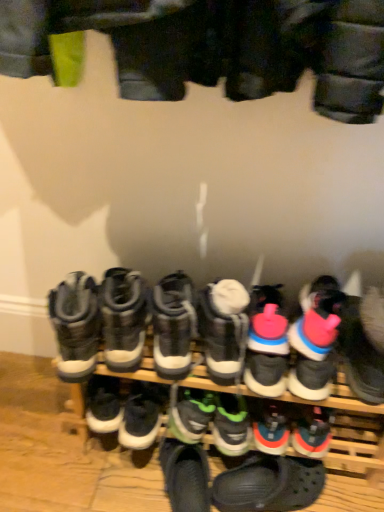
The image size is (384, 512). Describe the element at coordinates (231, 425) in the screenshot. I see `green rubber sneaker at center, which is the eighth footwear in left-to-right order` at that location.

I want to click on black rubber shoes at center, which is the seventh footwear from left to right, so click(x=216, y=337).

Image resolution: width=384 pixels, height=512 pixels. What do you see at coordinates (123, 318) in the screenshot? I see `white rubber boots at center, which ranks as the eleventh footwear in right-to-left order` at bounding box center [123, 318].

What do you see at coordinates (190, 413) in the screenshot?
I see `green matte sneakers at center, positioned as the eighth footwear in right-to-left order` at bounding box center [190, 413].

Describe the element at coordinates (223, 328) in the screenshot. I see `white suede boot at center, arranged as the sixth footwear when viewed from the left` at that location.

I want to click on green rubber sneaker at center, which is the eighth footwear in left-to-right order, so click(231, 425).

From the picture: From the image's perspective, is white matte sneaker at center, acting as the 10th footwear starting from the right, located above black rubber shoes at center, which appears as the 6th footwear when viewed from the right?

Incorrect, from the image's perspective, white matte sneaker at center, acting as the 10th footwear starting from the right, is lower than black rubber shoes at center, which appears as the 6th footwear when viewed from the right.

Which is more to the right, white matte sneaker at center, acting as the 10th footwear starting from the right, or black rubber shoes at center, which appears as the 6th footwear when viewed from the right?

black rubber shoes at center, which appears as the 6th footwear when viewed from the right, is more to the right.

Is white matte sneaker at center, acting as the 3th footwear starting from the left, in front of or behind black rubber shoes at center, which is the seventh footwear from left to right, in the image?

Clearly, white matte sneaker at center, acting as the 3th footwear starting from the left, is behind black rubber shoes at center, which is the seventh footwear from left to right.

Is black rubber shoes at center, which is the seventh footwear from left to right, in contact with pink rubber sneaker at center, placed as the 11th footwear when sorted from left to right?

black rubber shoes at center, which is the seventh footwear from left to right, is not next to pink rubber sneaker at center, placed as the 11th footwear when sorted from left to right, and they're not touching.

Based on their positions, is black rubber shoes at center, which is the seventh footwear from left to right, located to the left or right of pink rubber sneaker at center, arranged as the second footwear when viewed from the right?

Based on their positions, black rubber shoes at center, which is the seventh footwear from left to right, is located to the left of pink rubber sneaker at center, arranged as the second footwear when viewed from the right.

Considering the relative sizes of black rubber shoes at center, which is the seventh footwear from left to right, and pink rubber sneaker at center, arranged as the second footwear when viewed from the right, in the image provided, is black rubber shoes at center, which is the seventh footwear from left to right, wider than pink rubber sneaker at center, arranged as the second footwear when viewed from the right,?

No.

Is the position of white suede boot at center, which is the 7th footwear in right-to-left order, more distant than that of pink rubber sneaker at center, which appears as the fourth footwear when viewed from the right?

That is False.

Is white suede boot at center, which is the 7th footwear in right-to-left order, touching pink rubber sneaker at center, the ninth footwear from the left?

Indeed, white suede boot at center, which is the 7th footwear in right-to-left order, and pink rubber sneaker at center, the ninth footwear from the left, are beside each other and touching.

Image resolution: width=384 pixels, height=512 pixels. I want to click on footwear that is the 3rd one when counting leftward from the pink rubber sneaker at center, the ninth footwear from the left, so click(223, 328).

Could you tell me if white matte sneaker at center, acting as the 3th footwear starting from the left, is turned towards gray suede boots at left, which ranks as the twelfth footwear in right-to-left order?

No.

Do you think white matte sneaker at center, acting as the 3th footwear starting from the left, is within gray suede boots at left, the first footwear positioned from the left, or outside of it?

white matte sneaker at center, acting as the 3th footwear starting from the left, is spatially situated outside gray suede boots at left, the first footwear positioned from the left.

Considering the sizes of white matte sneaker at center, acting as the 10th footwear starting from the right, and gray suede boots at left, which ranks as the twelfth footwear in right-to-left order, in the image, is white matte sneaker at center, acting as the 10th footwear starting from the right, wider or thinner than gray suede boots at left, which ranks as the twelfth footwear in right-to-left order,?

Considering their sizes, white matte sneaker at center, acting as the 10th footwear starting from the right, looks slimmer than gray suede boots at left, which ranks as the twelfth footwear in right-to-left order.

Is white matte sneaker at center, acting as the 10th footwear starting from the right, positioned behind gray suede boots at left, the first footwear positioned from the left?

Yes, white matte sneaker at center, acting as the 10th footwear starting from the right, is further from the camera.

From the picture: From a real-world perspective, does white rubber boots at center, the second footwear viewed from the left, sit lower than pink rubber sneaker at center, placed as the 11th footwear when sorted from left to right?

Incorrect, from a real-world perspective, white rubber boots at center, the second footwear viewed from the left, is higher than pink rubber sneaker at center, placed as the 11th footwear when sorted from left to right.

Who is taller, white rubber boots at center, the second footwear viewed from the left, or pink rubber sneaker at center, placed as the 11th footwear when sorted from left to right?

white rubber boots at center, the second footwear viewed from the left, is taller.

Identify the location of footwear that is the 2nd object located in front of the pink rubber sneaker at center, arranged as the second footwear when viewed from the right. (123, 318).

From the image's perspective, is white rubber boots at center, the second footwear viewed from the left, on top of pink rubber sneaker at center, arranged as the second footwear when viewed from the right?

Yes, from the image's perspective, white rubber boots at center, the second footwear viewed from the left, is over pink rubber sneaker at center, arranged as the second footwear when viewed from the right.

Is black rubber shoes at center, which appears as the 6th footwear when viewed from the right, positioned beyond the bounds of gray suede boots at left, the first footwear positioned from the left?

Yes, black rubber shoes at center, which appears as the 6th footwear when viewed from the right, is outside of gray suede boots at left, the first footwear positioned from the left.

Is black rubber shoes at center, which appears as the 6th footwear when viewed from the right, in front of or behind gray suede boots at left, which ranks as the twelfth footwear in right-to-left order, in the image?

black rubber shoes at center, which appears as the 6th footwear when viewed from the right, is behind gray suede boots at left, which ranks as the twelfth footwear in right-to-left order.

Is black rubber shoes at center, which appears as the 6th footwear when viewed from the right, smaller than gray suede boots at left, which ranks as the twelfth footwear in right-to-left order?

Incorrect, black rubber shoes at center, which appears as the 6th footwear when viewed from the right, is not smaller in size than gray suede boots at left, which ranks as the twelfth footwear in right-to-left order.

Does black rubber shoes at center, which is the seventh footwear from left to right, have a greater height compared to gray suede boots at left, the first footwear positioned from the left?

Yes, black rubber shoes at center, which is the seventh footwear from left to right, is taller than gray suede boots at left, the first footwear positioned from the left.

From the picture: From a real-world perspective, is white suede boot at center, which is the 7th footwear in right-to-left order, physically above white matte sneaker at center, acting as the 10th footwear starting from the right?

Yes, from a real-world perspective, white suede boot at center, which is the 7th footwear in right-to-left order, is over white matte sneaker at center, acting as the 10th footwear starting from the right

Are white suede boot at center, arranged as the sixth footwear when viewed from the left, and white matte sneaker at center, acting as the 3th footwear starting from the left, located far from each other?

No, there isn't a large distance between white suede boot at center, arranged as the sixth footwear when viewed from the left, and white matte sneaker at center, acting as the 3th footwear starting from the left.

Which object is wider, white suede boot at center, arranged as the sixth footwear when viewed from the left, or white matte sneaker at center, acting as the 10th footwear starting from the right?

white suede boot at center, arranged as the sixth footwear when viewed from the left, is wider.

Considering the positions of objects white suede boot at center, which is the 7th footwear in right-to-left order, and white matte sneaker at center, acting as the 10th footwear starting from the right, in the image provided, who is behind, white suede boot at center, which is the 7th footwear in right-to-left order, or white matte sneaker at center, acting as the 10th footwear starting from the right,?

white matte sneaker at center, acting as the 10th footwear starting from the right, is further from the camera.

Where is `footwear that is the 4th object located in front of the white matte sneaker at center, acting as the 3th footwear starting from the left`? The image size is (384, 512). footwear that is the 4th object located in front of the white matte sneaker at center, acting as the 3th footwear starting from the left is located at coordinates (216, 337).

Where is `the 4th footwear directly above the black rubber shoes at center, which appears as the 6th footwear when viewed from the right (from a real-world perspective)`? This screenshot has height=512, width=384. the 4th footwear directly above the black rubber shoes at center, which appears as the 6th footwear when viewed from the right (from a real-world perspective) is located at coordinates (314, 341).

From the image, which object appears to be farther from black suede sneakers at center, the 4th footwear in the left-to-right sequence, green rubber sneaker at center, which appears as the fifth footwear when viewed from the right, or black rubber shoes at center, which is the seventh footwear from left to right?

Among the two, green rubber sneaker at center, which appears as the fifth footwear when viewed from the right, is located further to black suede sneakers at center, the 4th footwear in the left-to-right sequence.

Looking at the image, which one is located closer to gray suede boots at left, which ranks as the twelfth footwear in right-to-left order, white rubber boots at center, the second footwear viewed from the left, or black suede sneakers at center, which is the 9th footwear from right to left?

Among the two, white rubber boots at center, the second footwear viewed from the left, is located nearer to gray suede boots at left, which ranks as the twelfth footwear in right-to-left order.

From the image, which object appears to be nearer to white suede boot at center, which is the 7th footwear in right-to-left order, green matte sneakers at center, the 5th footwear in the left-to-right sequence, or black suede sneakers at center, which is the 9th footwear from right to left?

black suede sneakers at center, which is the 9th footwear from right to left, is closer to white suede boot at center, which is the 7th footwear in right-to-left order.

Based on the photo, considering their positions, is pink rubber sneaker at center, the ninth footwear from the left, positioned closer to white rubber boots at center, which ranks as the eleventh footwear in right-to-left order, than white suede boot at center, arranged as the sixth footwear when viewed from the left?

Among the two, white suede boot at center, arranged as the sixth footwear when viewed from the left, is located nearer to white rubber boots at center, which ranks as the eleventh footwear in right-to-left order.

Estimate the real-world distances between objects in this image. Which object is closer to white suede boot at center, which is the 7th footwear in right-to-left order, pink rubber sneaker at center, the ninth footwear from the left, or white rubber boots at center, which ranks as the eleventh footwear in right-to-left order?

pink rubber sneaker at center, the ninth footwear from the left.

Considering their positions, is black rubber clogs at lower center, positioned as the third footwear in right-to-left order, positioned further to white rubber boots at center, the second footwear viewed from the left, than green rubber sneaker at center, which is the eighth footwear in left-to-right order?

black rubber clogs at lower center, positioned as the third footwear in right-to-left order.

Considering their positions, is pink rubber sneaker at center, placed as the 11th footwear when sorted from left to right, positioned closer to pink rubber sneaker at center, the ninth footwear from the left, than black rubber clogs at lower center, positioned as the third footwear in right-to-left order?

pink rubber sneaker at center, placed as the 11th footwear when sorted from left to right, lies closer to pink rubber sneaker at center, the ninth footwear from the left, than the other object.

Looking at the image, which one is located closer to green matte sneakers at center, the 5th footwear in the left-to-right sequence, white suede boot at center, which is the 7th footwear in right-to-left order, or black rubber clogs at lower center, positioned as the third footwear in right-to-left order?

Based on the image, white suede boot at center, which is the 7th footwear in right-to-left order, appears to be nearer to green matte sneakers at center, the 5th footwear in the left-to-right sequence.

At what (x,y) coordinates should I click in order to perform the action: click on footwear between green matte sneakers at center, positioned as the eighth footwear in right-to-left order, and black rubber clogs at lower center, positioned as the third footwear in right-to-left order, in the vertical direction. Please return your answer as a coordinate pair (x, y). The height and width of the screenshot is (512, 384). Looking at the image, I should click on pyautogui.click(x=231, y=425).